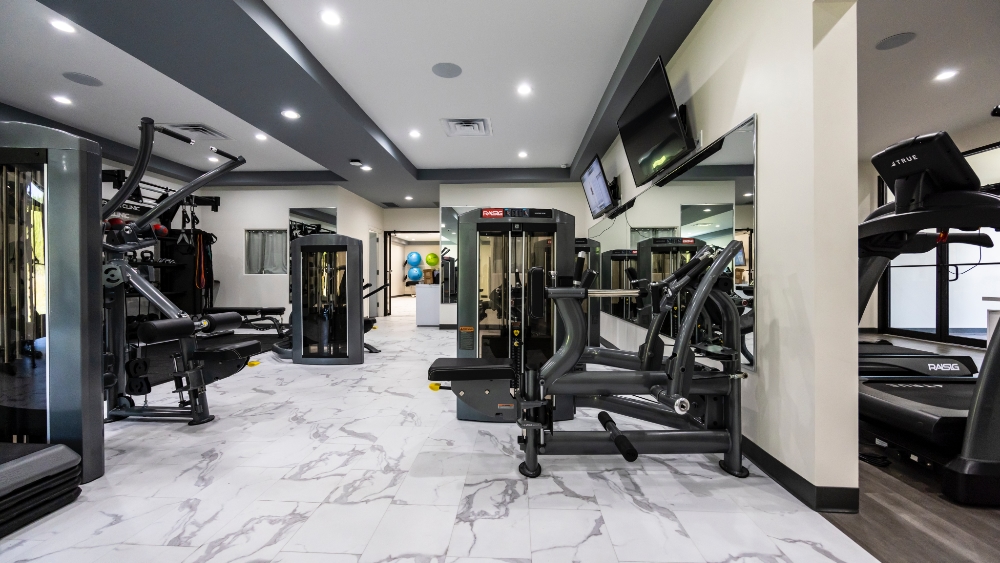
Identify the location of tvs. The image size is (1000, 563). (602, 187), (656, 131).